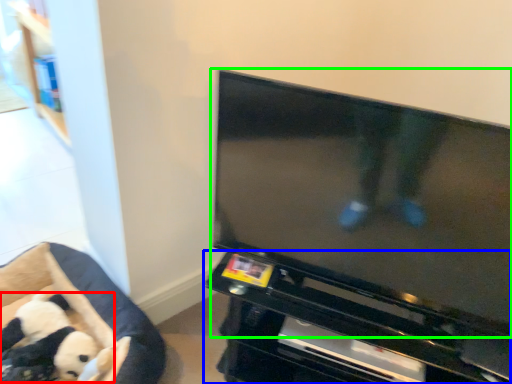
Question: Which object is the farthest from toy (highlighted by a red box)? Choose among these: entertainment center (highlighted by a blue box) or television (highlighted by a green box).

Choices:
 (A) entertainment center
 (B) television

Answer: (B)